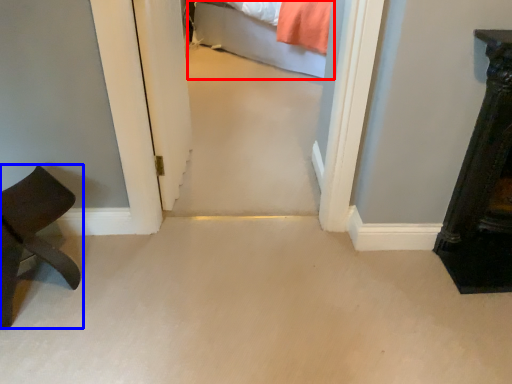
Question: Which of the following is the closest to the observer, bed (highlighted by a red box) or furniture (highlighted by a blue box)?

Choices:
 (A) bed
 (B) furniture

Answer: (B)